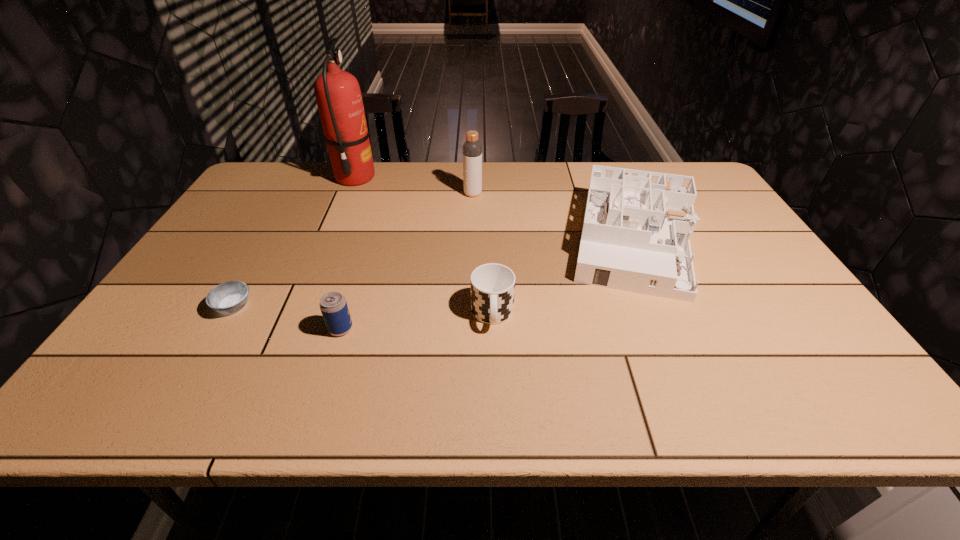
Identify the location of free space at the near edge of the desktop. The height and width of the screenshot is (540, 960). (327, 403).

Locate an element on the screen. vacant space at the left edge of the desktop is located at coordinates (269, 227).

You are a GUI agent. You are given a task and a screenshot of the screen. Output one action in this format:
    pyautogui.click(x=<x>, y=<y>)
    Task: Click on the vacant space at the right edge of the desktop
    
    Given the screenshot: What is the action you would take?
    pyautogui.click(x=766, y=280)

This screenshot has height=540, width=960. In order to click on vacant space at the far left corner of the desktop in this screenshot , I will do `click(295, 178)`.

I want to click on free point between the fourth object from right to left and the bottle, so click(407, 261).

You are a GUI agent. You are given a task and a screenshot of the screen. Output one action in this format:
    pyautogui.click(x=<x>, y=<y>)
    Task: Click on the vacant region between the bottle and the beer can
    Image resolution: width=960 pixels, height=540 pixels.
    Given the screenshot: What is the action you would take?
    pyautogui.click(x=407, y=261)

Image resolution: width=960 pixels, height=540 pixels. What are the coordinates of `blank region between the cup and the second tallest object` in the screenshot? It's located at (483, 254).

Find the location of a particular element. This screenshot has width=960, height=540. vacant region between the tallest object and the fifth shortest object is located at coordinates (414, 186).

Find the location of `free space between the cup and the ashtray`. free space between the cup and the ashtray is located at coordinates (363, 310).

The height and width of the screenshot is (540, 960). Find the location of `vacant area that lies between the second tallest object and the beer can`. vacant area that lies between the second tallest object and the beer can is located at coordinates (407, 261).